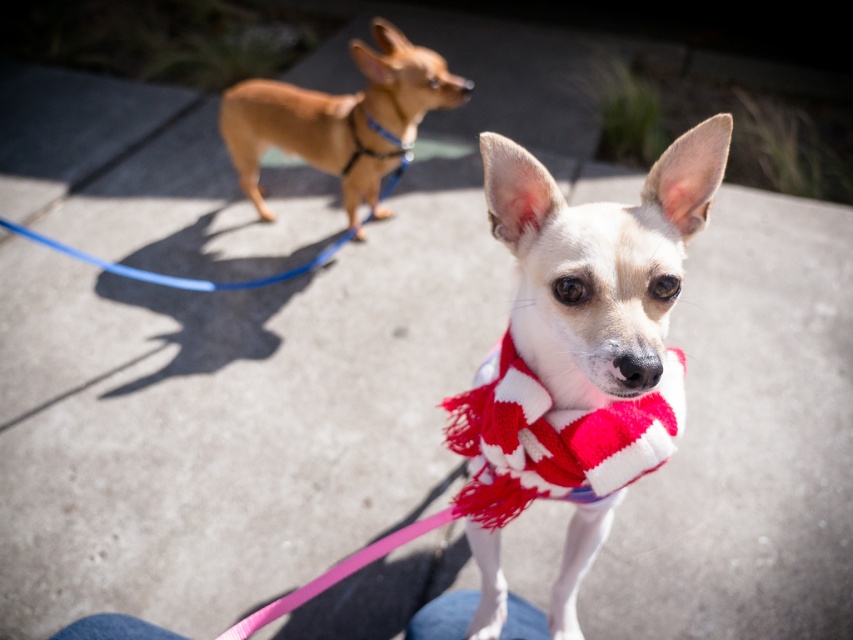
You are a dog owner who wants to walk both dogs at the same time. The pink fabric leash at center is attached to the white dog, and the blue rubber leash at upper left is attached to the brown dog. If you hold both leashes, which dog will have more slack in their leash?

The blue rubber leash at upper left is longer than the pink fabric leash at center, so the brown dog attached to the blue rubber leash at upper left will have more slack in their leash.

From the picture: You are a photographer trying to capture both the red knitted scarf at center and the blue rubber leash at upper left in the same frame. Based on their positions, which object should you adjust your camera angle to focus on first to ensure both are visible?

The red knitted scarf at center is to the right of the blue rubber leash at upper left. To include both in the frame, you should first focus on the blue rubber leash at upper left since it is on the left side, then adjust the camera to include the red knitted scarf at center on the right.